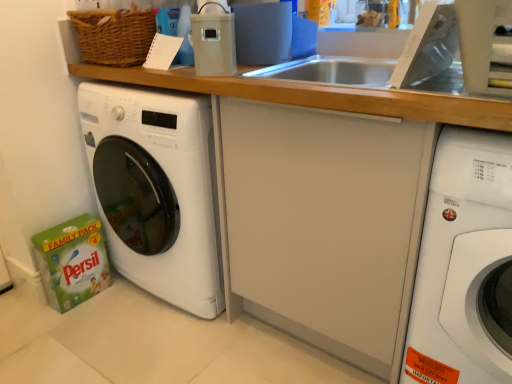
Question: Is matte plastic container at upper center a part of white glossy washing machine at right, positioned as the first washing machine in right-to-left order?

Choices:
 (A) yes
 (B) no

Answer: (B)

Question: Considering the relative positions of white glossy washing machine at right, positioned as the first washing machine in right-to-left order, and matte plastic container at upper center in the image provided, is white glossy washing machine at right, positioned as the first washing machine in right-to-left order, behind matte plastic container at upper center?

Choices:
 (A) yes
 (B) no

Answer: (B)

Question: Can you confirm if white glossy washing machine at right, acting as the 2th washing machine starting from the left, is thinner than matte plastic container at upper center?

Choices:
 (A) yes
 (B) no

Answer: (B)

Question: Can you confirm if white glossy washing machine at right, acting as the 2th washing machine starting from the left, is bigger than matte plastic container at upper center?

Choices:
 (A) no
 (B) yes

Answer: (B)

Question: Is white glossy washing machine at right, positioned as the first washing machine in right-to-left order, not inside matte plastic container at upper center?

Choices:
 (A) no
 (B) yes

Answer: (B)

Question: Does white glossy washing machine at right, positioned as the first washing machine in right-to-left order, have a smaller size compared to matte plastic container at upper center?

Choices:
 (A) yes
 (B) no

Answer: (B)

Question: Does white glossy washing machine at right, positioned as the first washing machine in right-to-left order, turn towards white glossy washing machine at left, which is the first washing machine in left-to-right order?

Choices:
 (A) no
 (B) yes

Answer: (A)

Question: From the image's perspective, would you say white glossy washing machine at right, positioned as the first washing machine in right-to-left order, is positioned over white glossy washing machine at left, which is the first washing machine in left-to-right order?

Choices:
 (A) yes
 (B) no

Answer: (B)

Question: Considering the relative sizes of white glossy washing machine at right, acting as the 2th washing machine starting from the left, and white glossy washing machine at left, the second washing machine when ordered from right to left, in the image provided, is white glossy washing machine at right, acting as the 2th washing machine starting from the left, thinner than white glossy washing machine at left, the second washing machine when ordered from right to left,?

Choices:
 (A) no
 (B) yes

Answer: (B)

Question: Can you see white glossy washing machine at right, acting as the 2th washing machine starting from the left, touching white glossy washing machine at left, which is the first washing machine in left-to-right order?

Choices:
 (A) yes
 (B) no

Answer: (B)

Question: Would you consider white glossy washing machine at right, positioned as the first washing machine in right-to-left order, to be distant from white glossy washing machine at left, which is the first washing machine in left-to-right order?

Choices:
 (A) no
 (B) yes

Answer: (A)

Question: From a real-world perspective, is white glossy washing machine at right, positioned as the first washing machine in right-to-left order, positioned under white glossy washing machine at left, the second washing machine when ordered from right to left, based on gravity?

Choices:
 (A) yes
 (B) no

Answer: (A)

Question: Is matte plastic container at upper center oriented towards white glossy washing machine at right, positioned as the first washing machine in right-to-left order?

Choices:
 (A) no
 (B) yes

Answer: (A)